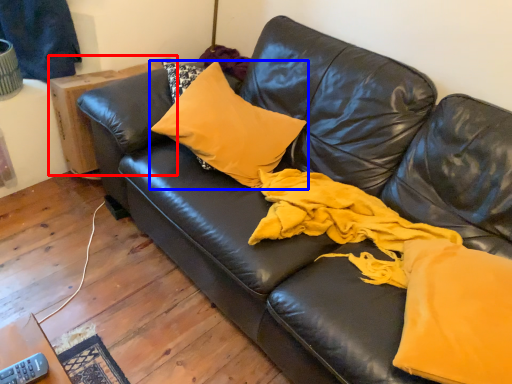
Question: Which object is closer to the camera taking this photo, table (highlighted by a red box) or pillow (highlighted by a blue box)?

Choices:
 (A) table
 (B) pillow

Answer: (B)